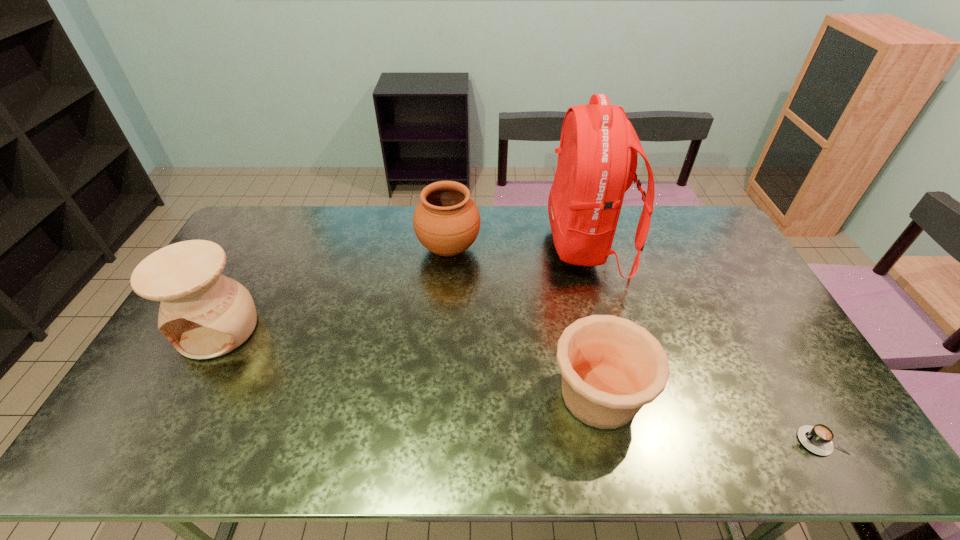
Locate an element on the screen. vacant area situated 0.260m on the main compartment of the backpack is located at coordinates (475, 246).

Find the location of a particular element. This screenshot has width=960, height=540. free space located at the open side of the leftmost object is located at coordinates (175, 410).

In order to click on free space located 0.200m on the right of the farthest pottery in this screenshot , I will do `click(537, 249)`.

Where is `vacant space situated on the left of the rightmost pottery`? The image size is (960, 540). vacant space situated on the left of the rightmost pottery is located at coordinates (408, 395).

I want to click on free space located with the handle on the side of the cappuccino, so click(x=745, y=441).

What are the coordinates of `vacant region located 0.210m with the handle on the side of the cappuccino` in the screenshot? It's located at (711, 441).

At what (x,y) coordinates should I click in order to perform the action: click on vacant space located 0.400m with the handle on the side of the cappuccino. Please return your answer as a coordinate pair (x, y). Looking at the image, I should click on (634, 441).

You are a GUI agent. You are given a task and a screenshot of the screen. Output one action in this format:
    pyautogui.click(x=<x>, y=<y>)
    Task: Click on the backpack at the far edge
    
    Given the screenshot: What is the action you would take?
    click(x=597, y=157)

Where is `pottery that is positioned at the far edge`? pottery that is positioned at the far edge is located at coordinates (446, 221).

In order to click on pottery located in the near edge section of the desktop in this screenshot , I will do `click(611, 367)`.